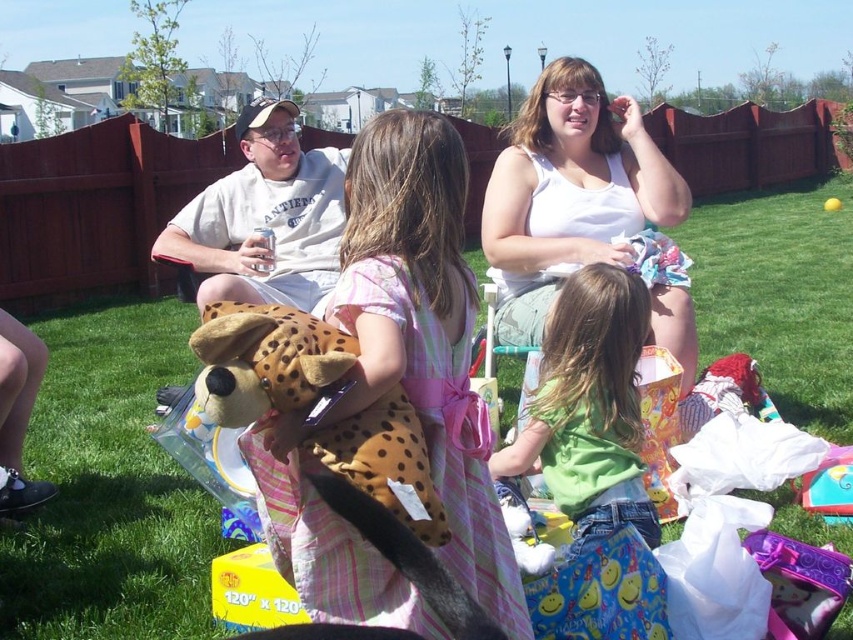
Question: Can you confirm if soft pink dress at center is smaller than green cotton shirt at center?

Choices:
 (A) yes
 (B) no

Answer: (A)

Question: Can you confirm if white cotton tank top at upper center is smaller than green cotton shirt at center?

Choices:
 (A) no
 (B) yes

Answer: (A)

Question: Which point is farther from the camera taking this photo?

Choices:
 (A) (466, 518)
 (B) (631, 406)
 (C) (628, 148)

Answer: (C)

Question: Where is soft pink dress at center located in relation to green cotton shirt at center in the image?

Choices:
 (A) right
 (B) left

Answer: (B)

Question: Considering the real-world distances, which object is farthest from the soft pink dress at center?

Choices:
 (A) white cotton tank top at upper center
 (B) green cotton shirt at center

Answer: (A)

Question: Which object appears farthest from the camera in this image?

Choices:
 (A) white cotton tank top at upper center
 (B) soft pink dress at center

Answer: (A)